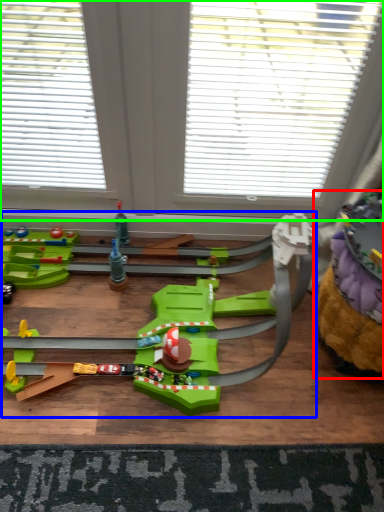
Question: Considering the real-world distances, which object is closest to toy (highlighted by a red box)? toy (highlighted by a blue box) or window (highlighted by a green box).

Choices:
 (A) toy
 (B) window

Answer: (A)